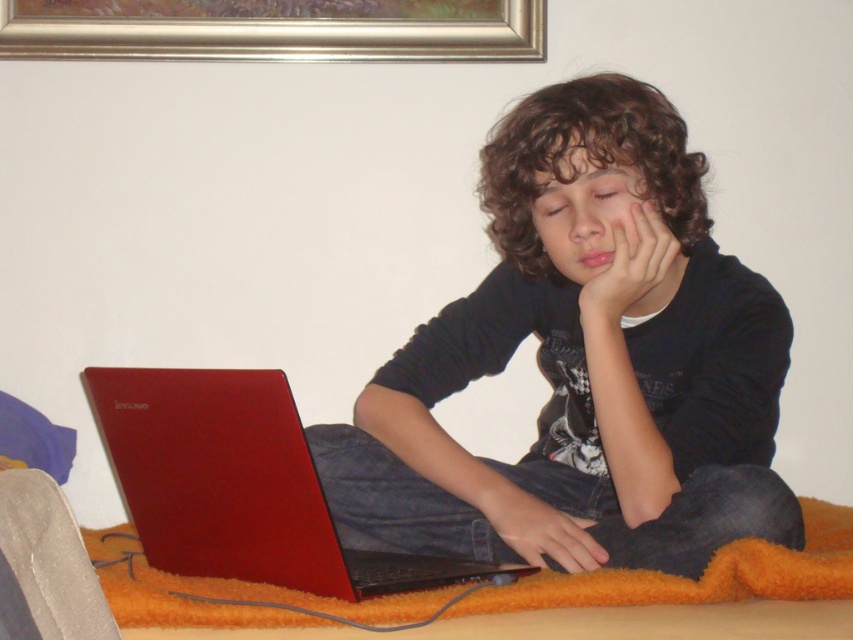
Is orange fuzzy blanket at lower center closer to the viewer compared to matte skin hand at center?

Yes.

Between point (109, 554) and point (610, 307), which one is positioned in front?

Point (610, 307) is more forward.

What are the coordinates of `orange fuzzy blanket at lower center` in the screenshot? It's located at (701, 576).

Which is above, matte skin hand at center or matte black hand at lower center?

Positioned higher is matte skin hand at center.

Is point (676, 269) closer to camera compared to point (566, 531)?

No, (676, 269) is behind (566, 531).

Does point (624, 269) lie behind point (480, 474)?

No, (624, 269) is closer to viewer.

In order to click on matte skin hand at center in this screenshot , I will do `click(628, 269)`.

Who is taller, orange fuzzy blanket at lower center or matte black hand at lower center?

matte black hand at lower center

Who is more forward, (112, 563) or (573, 570)?

Positioned in front is point (573, 570).

Find the location of a particular element. The width and height of the screenshot is (853, 640). orange fuzzy blanket at lower center is located at coordinates (701, 576).